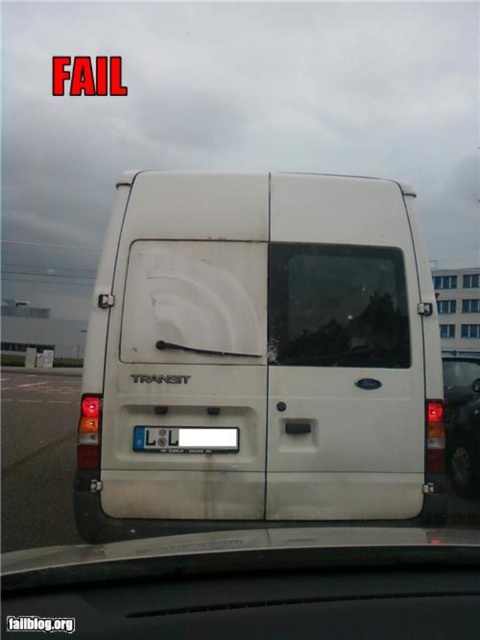
Does transparent glass windshield at center appear on the right side of white plastic license plate at center?

Yes, transparent glass windshield at center is to the right of white plastic license plate at center.

Between point (384, 269) and point (137, 433), which one is positioned in front?

Positioned in front is point (137, 433).

Find the location of a particular element. The image size is (480, 640). transparent glass windshield at center is located at coordinates (336, 307).

Is matte white van at center positioned before white plastic license plate at center?

That is False.

Which is above, matte white van at center or white plastic license plate at center?

Positioned higher is white plastic license plate at center.

Which is behind, point (456, 452) or point (170, 440)?

Point (456, 452)

You are a GUI agent. You are given a task and a screenshot of the screen. Output one action in this format:
    pyautogui.click(x=<x>, y=<y>)
    Task: Click on the matte white van at center
    Image resolution: width=480 pixels, height=640 pixels.
    Given the screenshot: What is the action you would take?
    pyautogui.click(x=462, y=420)

Is white matte van at center smaller than transparent glass windshield at center?

No, white matte van at center is not smaller than transparent glass windshield at center.

Which is more to the right, white matte van at center or transparent glass windshield at center?

From the viewer's perspective, transparent glass windshield at center appears more on the right side.

Identify the location of white matte van at center. (261, 353).